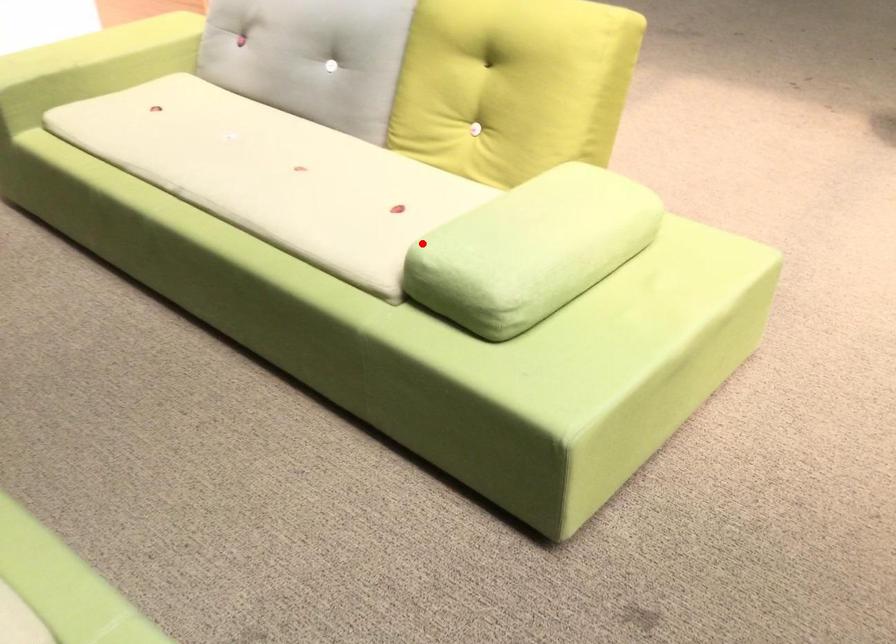
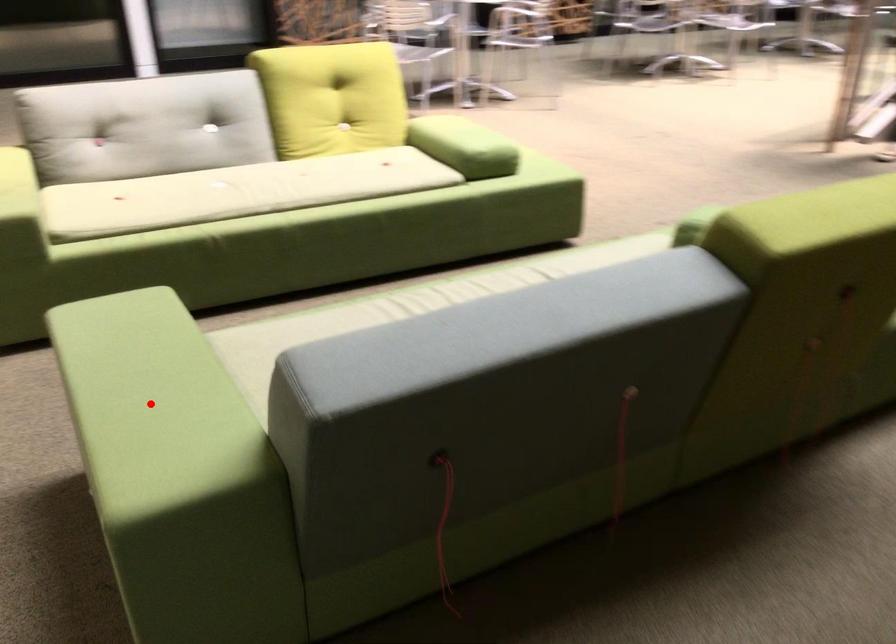
I am providing you with two images of the same scene from different viewpoints. A red point is marked on the first image and another point is marked on the second image. Does the point marked in image1 correspond to the same location as the one in image2?

No